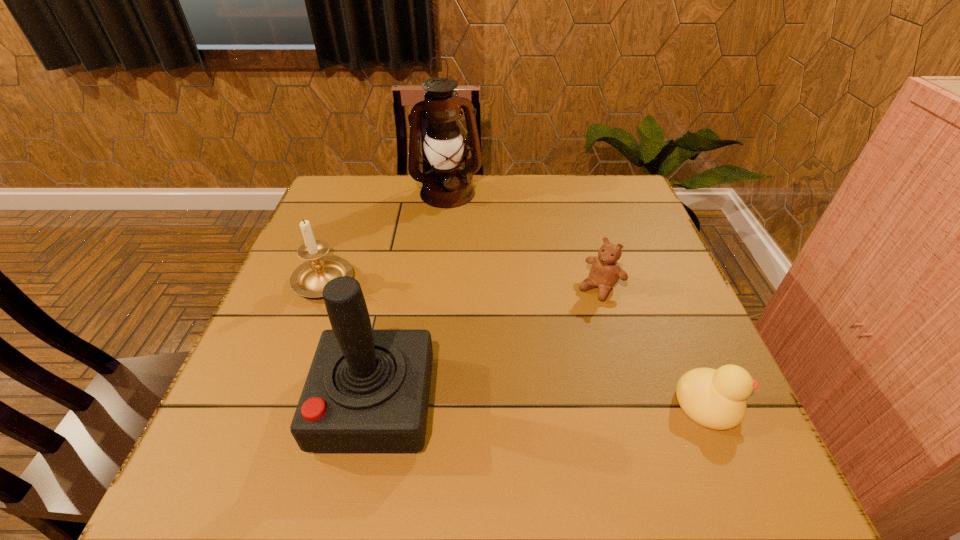
The height and width of the screenshot is (540, 960). What are the coordinates of `vacant space on the desktop that is between the second tallest object and the duckling and is positioned on the side of the lantern, there is a wick adjustment knob` in the screenshot? It's located at (520, 403).

You are a GUI agent. You are given a task and a screenshot of the screen. Output one action in this format:
    pyautogui.click(x=<x>, y=<y>)
    Task: Click on the vacant space on the desktop that is between the joystick and the duckling and is positioned on the face of the teddy bear
    The image size is (960, 540).
    Given the screenshot: What is the action you would take?
    pyautogui.click(x=492, y=403)

Find the location of `free space on the desktop that is between the second tallest object and the shortest object and is positioned with a handle on the side of the third shortest object`. free space on the desktop that is between the second tallest object and the shortest object and is positioned with a handle on the side of the third shortest object is located at coordinates (538, 403).